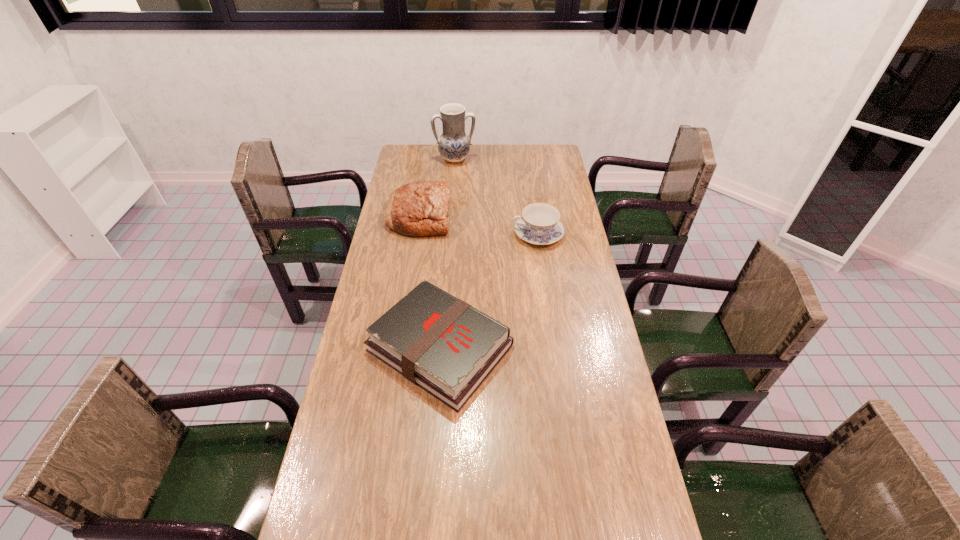
I want to click on free space that satisfies the following two spatial constraints: 1. at the sliced front of the bread; 2. with the handle on the side of the chinaware, so click(417, 234).

This screenshot has width=960, height=540. Identify the location of vacant area in the image that satisfies the following two spatial constraints: 1. at the sliced front of the bread; 2. on the right side of the nearest object. (398, 348).

At what (x,y) coordinates should I click in order to perform the action: click on vacant space that satisfies the following two spatial constraints: 1. at the sliced front of the nearest object; 2. on the right side of the bread. Please return your answer as a coordinate pair (x, y). Looking at the image, I should click on (398, 348).

Where is `blank space that satisfies the following two spatial constraints: 1. at the sliced front of the bread; 2. with the handle on the side of the chinaware`? The image size is (960, 540). blank space that satisfies the following two spatial constraints: 1. at the sliced front of the bread; 2. with the handle on the side of the chinaware is located at coordinates (417, 234).

The width and height of the screenshot is (960, 540). Find the location of `vacant space that satisfies the following two spatial constraints: 1. at the sliced front of the bread; 2. with the handle on the side of the rightmost object`. vacant space that satisfies the following two spatial constraints: 1. at the sliced front of the bread; 2. with the handle on the side of the rightmost object is located at coordinates (417, 234).

The image size is (960, 540). In order to click on vacant space that satisfies the following two spatial constraints: 1. at the sliced front of the hardback book; 2. on the left side of the third shortest object in this screenshot , I will do `click(398, 348)`.